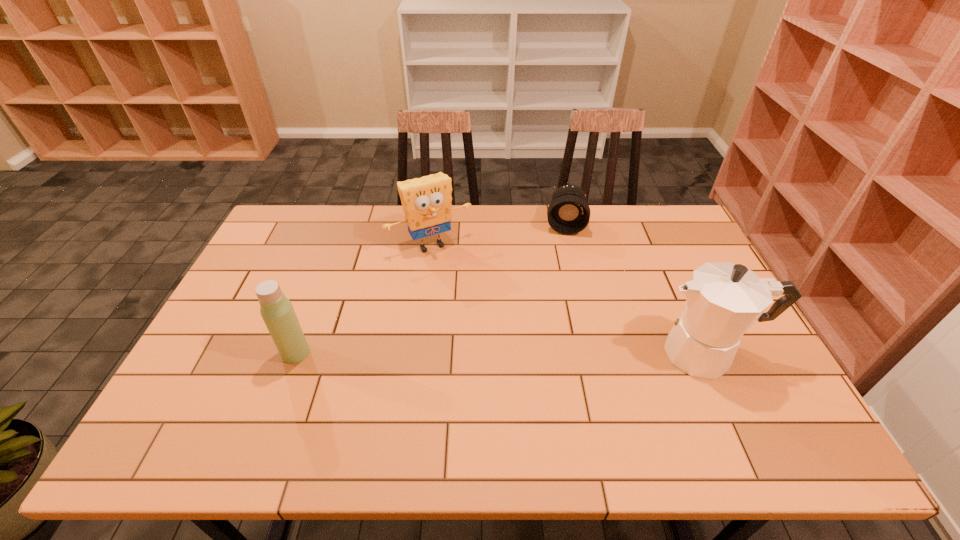
Locate an element on the screen. vacant space located on the face of the sponge is located at coordinates (463, 283).

Find the location of a particular element. The image size is (960, 540). free space located on the face of the sponge is located at coordinates (475, 302).

Find the location of a particular element. vacant space located 0.340m on the face of the sponge is located at coordinates (493, 331).

Locate an element on the screen. This screenshot has height=540, width=960. blank area located at the front element of the second object from right to left is located at coordinates click(x=564, y=256).

Identify the location of free space located 0.300m at the front element of the second object from right to left. The height and width of the screenshot is (540, 960). (562, 299).

Where is `vacant space situated at the front element of the second object from right to left`? This screenshot has height=540, width=960. vacant space situated at the front element of the second object from right to left is located at coordinates tap(564, 248).

What are the coordinates of `sponge that is at the far edge` in the screenshot? It's located at (426, 201).

The image size is (960, 540). Find the location of `telephoto lens present at the far edge`. telephoto lens present at the far edge is located at coordinates (568, 213).

What are the coordinates of `object that is at the right edge` in the screenshot? It's located at (723, 300).

In the image, there is a desktop. Where is `free region at the far edge`? The image size is (960, 540). free region at the far edge is located at coordinates (601, 241).